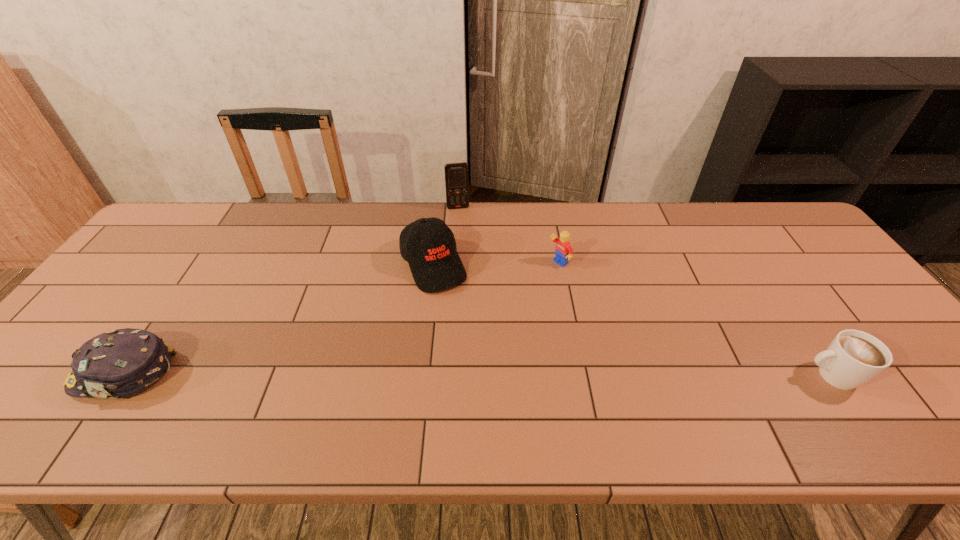
At what (x,y) coordinates should I click in order to perform the action: click on baseball cap present at the far edge. Please return your answer as a coordinate pair (x, y). The height and width of the screenshot is (540, 960). Looking at the image, I should click on (435, 264).

Locate an element on the screen. The width and height of the screenshot is (960, 540). headwear at the near edge is located at coordinates (119, 363).

You are a GUI agent. You are given a task and a screenshot of the screen. Output one action in this format:
    pyautogui.click(x=<x>, y=<y>)
    Task: Click on the cappuccino positioned at the near edge
    The height and width of the screenshot is (540, 960).
    Given the screenshot: What is the action you would take?
    pyautogui.click(x=853, y=358)

Find the location of a particular element. The image size is (960, 540). object that is at the left edge is located at coordinates (119, 363).

Identify the location of object that is at the right edge. (853, 358).

Find the location of a particular element. object at the near left corner is located at coordinates (119, 363).

Identify the location of object that is at the near right corner. (853, 358).

Find the location of `free region at the far edge of the desktop`. free region at the far edge of the desktop is located at coordinates (749, 246).

Where is `vacant space at the left edge`? vacant space at the left edge is located at coordinates (148, 314).

The height and width of the screenshot is (540, 960). In the image, there is a desktop. Identify the location of free space at the right edge. (866, 310).